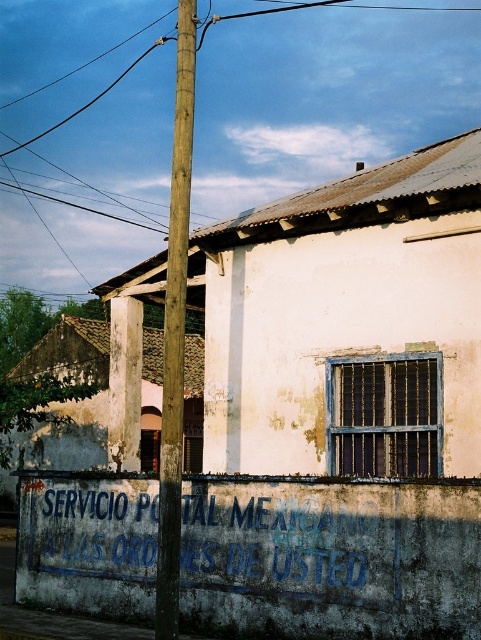
In the scene shown: Can you confirm if blue faded graffiti at lower center is wider than wooden telegraph pole at center?

No.

Is blue faded graffiti at lower center positioned in front of wooden telegraph pole at center?

No, blue faded graffiti at lower center is further to the viewer.

Identify the location of blue faded graffiti at lower center. (279, 541).